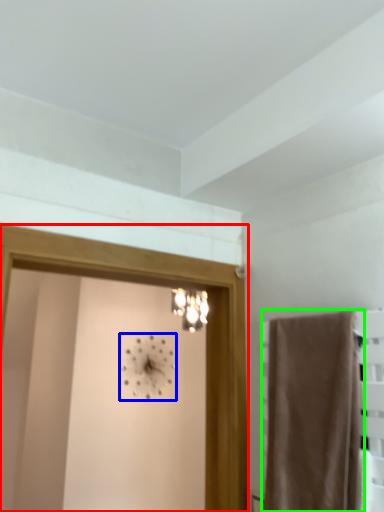
Question: Based on their relative distances, which object is farther from screen door (highlighted by a red box)? Choose from clock (highlighted by a blue box) and curtain (highlighted by a green box).

Choices:
 (A) clock
 (B) curtain

Answer: (A)